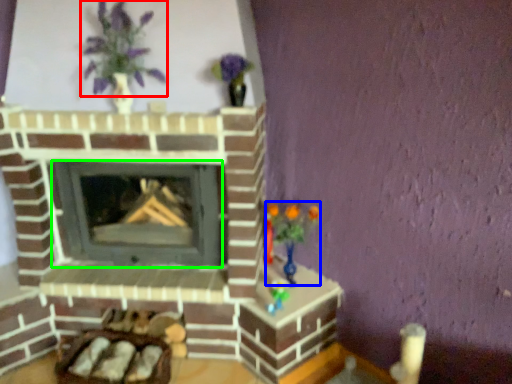
Question: Which object is the closest to the floral arrangement (highlighted by a red box)? Choose among these: toy (highlighted by a blue box) or wood burning stove (highlighted by a green box).

Choices:
 (A) toy
 (B) wood burning stove

Answer: (B)